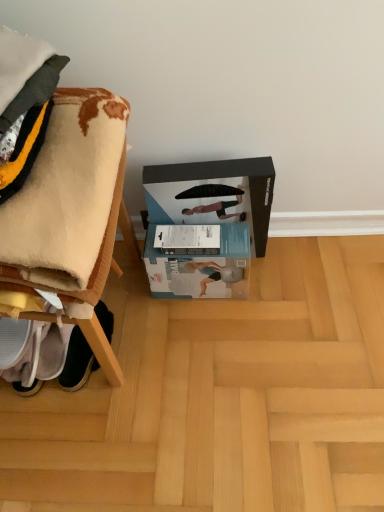
Question: Does light brown wood at lower center come in front of white soft blanket at left?

Choices:
 (A) no
 (B) yes

Answer: (A)

Question: Is light brown wood at lower center at the right side of white soft blanket at left?

Choices:
 (A) no
 (B) yes

Answer: (B)

Question: Can you confirm if light brown wood at lower center is thinner than white soft blanket at left?

Choices:
 (A) no
 (B) yes

Answer: (A)

Question: From the image's perspective, is light brown wood at lower center on white soft blanket at left?

Choices:
 (A) yes
 (B) no

Answer: (B)

Question: Considering the relative sizes of light brown wood at lower center and white soft blanket at left in the image provided, is light brown wood at lower center wider than white soft blanket at left?

Choices:
 (A) no
 (B) yes

Answer: (B)

Question: Is black matte cardboard box at center taller or shorter than white cardboard box at center?

Choices:
 (A) tall
 (B) short

Answer: (A)

Question: From a real-world perspective, is black matte cardboard box at center physically located above or below white cardboard box at center?

Choices:
 (A) below
 (B) above

Answer: (B)

Question: Does point (243, 254) appear closer or farther from the camera than point (187, 274)?

Choices:
 (A) farther
 (B) closer

Answer: (B)

Question: Is black matte cardboard box at center bigger or smaller than white cardboard box at center?

Choices:
 (A) small
 (B) big

Answer: (B)

Question: Is point (225, 496) closer or farther from the camera than point (36, 233)?

Choices:
 (A) farther
 (B) closer

Answer: (A)

Question: Considering the positions of light brown wood at lower center and white soft blanket at left in the image, is light brown wood at lower center taller or shorter than white soft blanket at left?

Choices:
 (A) short
 (B) tall

Answer: (A)

Question: Considering their positions, is light brown wood at lower center located in front of or behind white soft blanket at left?

Choices:
 (A) behind
 (B) front

Answer: (A)

Question: From the image's perspective, relative to white soft blanket at left, is light brown wood at lower center above or below?

Choices:
 (A) below
 (B) above

Answer: (A)

Question: Relative to white soft blanket at left, is white fabric shoe at lower left in front or behind?

Choices:
 (A) behind
 (B) front

Answer: (A)

Question: From the image's perspective, relative to white soft blanket at left, is white fabric shoe at lower left above or below?

Choices:
 (A) below
 (B) above

Answer: (A)